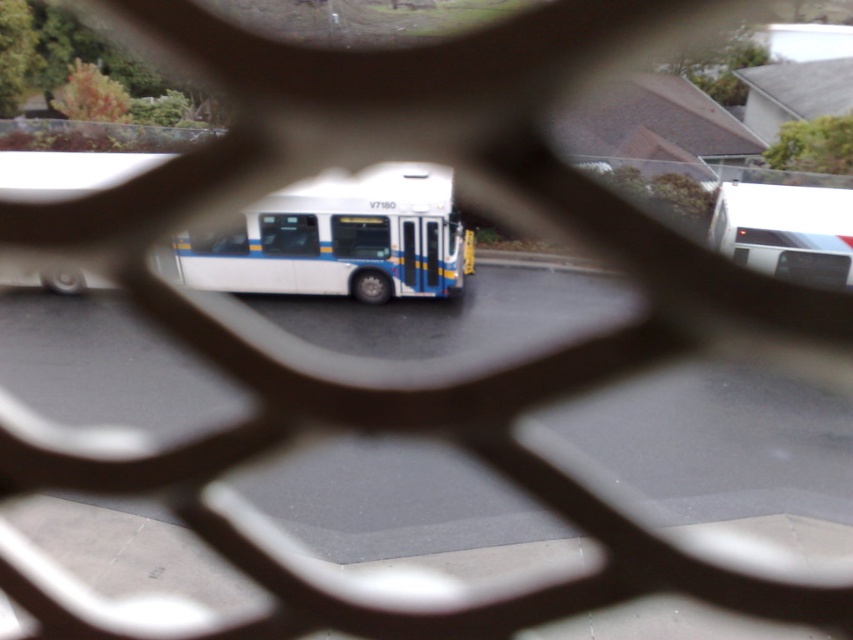
You are a photographer trying to capture the white matte bus at center and the white glossy bus at center through a fence. Since the fence has bars that are spaced 10 cm apart, can you fit both buses in your shot without any obstruction?

The white matte bus at center is located below the white glossy bus at center, so they are positioned vertically. Since the fence bars are spaced 10 cm apart horizontally, they won not block the vertical arrangement of the buses. Therefore, you can capture both buses in your shot without obstruction.

You are standing in front of a fence and see two buses through it. The buses are labeled as white matte bus at center and white glossy bus at center. Which one is positioned to the left when viewed from your perspective?

The white matte bus at center is positioned to the left of the white glossy bus at center when viewed from your perspective.